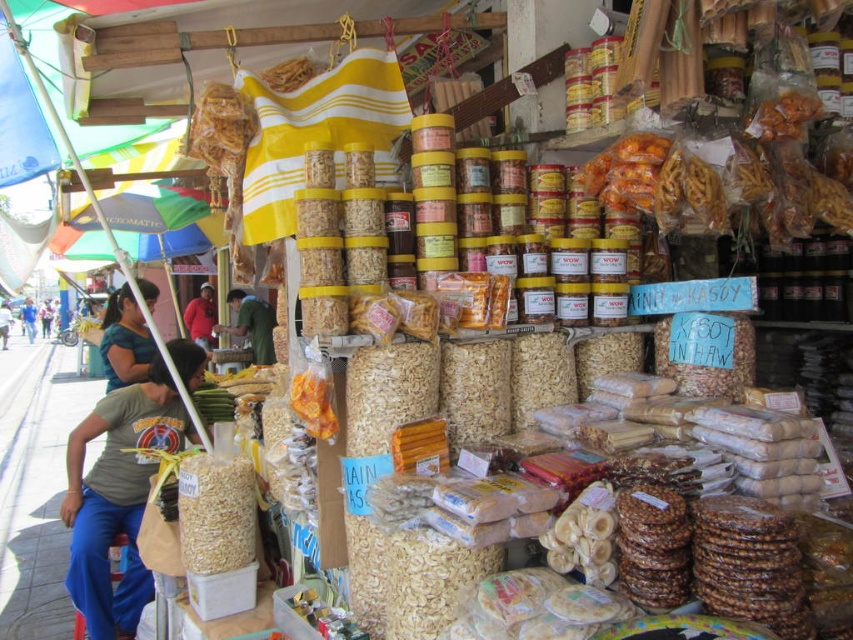
Between point (196, 316) and point (49, 333), which one is positioned in front?

Point (196, 316)

Is point (187, 310) farther from camera compared to point (45, 300)?

No, (187, 310) is in front of (45, 300).

You are a GUI agent. You are given a task and a screenshot of the screen. Output one action in this format:
    pyautogui.click(x=<x>, y=<y>)
    Task: Click on the red cotton shirt at center
    The height and width of the screenshot is (640, 853).
    Given the screenshot: What is the action you would take?
    (x=200, y=316)

Between brown matte cereal at center and red cotton shirt at center, which one has less height?

Standing shorter between the two is brown matte cereal at center.

Between point (241, 515) and point (206, 321), which one is positioned behind?

Point (206, 321)

Is point (196, 564) farther from viewer compared to point (206, 314)?

No, it is not.

The width and height of the screenshot is (853, 640). I want to click on brown matte cereal at center, so click(x=216, y=513).

Who is taller, green cotton shirt at lower left or blue-green fabric shirt at left?

green cotton shirt at lower left is taller.

Which is more to the right, green cotton shirt at lower left or blue-green fabric shirt at left?

green cotton shirt at lower left

Between point (97, 628) and point (131, 376), which one is positioned behind?

The point (131, 376) is more distant.

Where is `green cotton shirt at lower left`? The height and width of the screenshot is (640, 853). green cotton shirt at lower left is located at coordinates (117, 497).